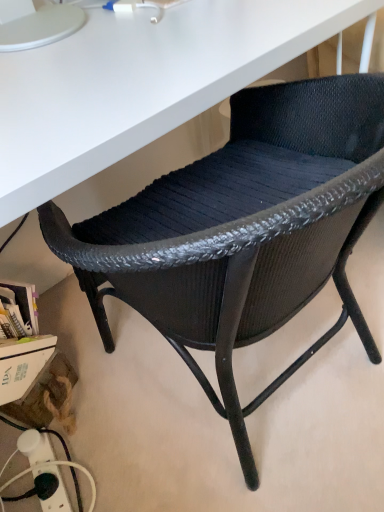
This screenshot has width=384, height=512. What are the coordinates of `vacant area located to the right-hand side of black plastic power strip at lower left` in the screenshot? It's located at (116, 461).